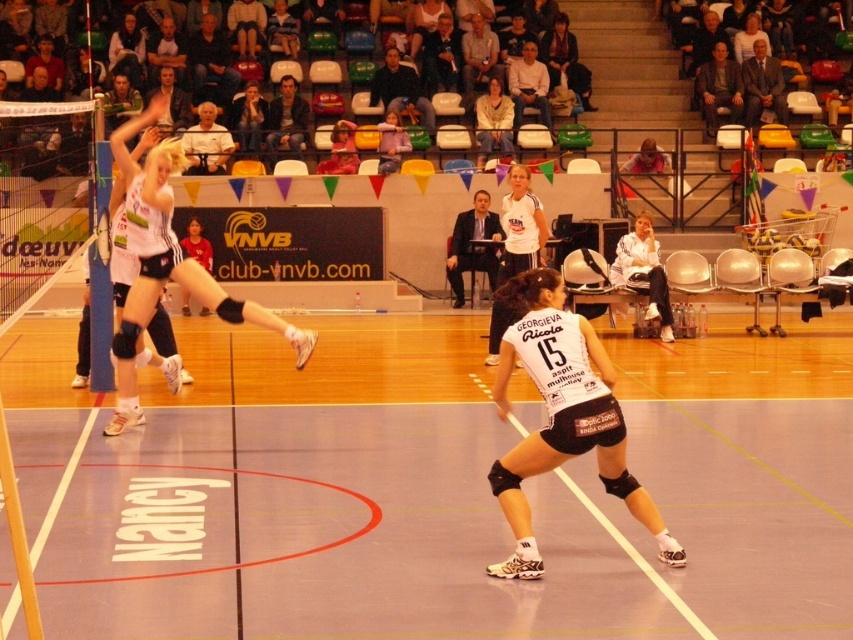
You are a photographer at the volleyball match and want to capture both the white fabric jacket at upper right and the dark brown leather jacket at upper center in a single shot. Which jacket will appear smaller in the photo?

The white fabric jacket at upper right will appear smaller in the photo because it is not as tall as the dark brown leather jacket at upper center, meaning it is closer to the photographer while the taller jacket is further away.

You are a volleyball coach standing at the center line of the court. You want to retrieve the white matte knee pads at upper left for a player. The court is 60 feet long. Can you walk directly from your current position to the knee pads without crossing the boundary lines?

The white matte knee pads at upper left are 35.44 feet away from your current position at the center line. Since the court is 60 feet long, the distance is within the court boundaries, so you can walk directly to retrieve them without crossing the lines.